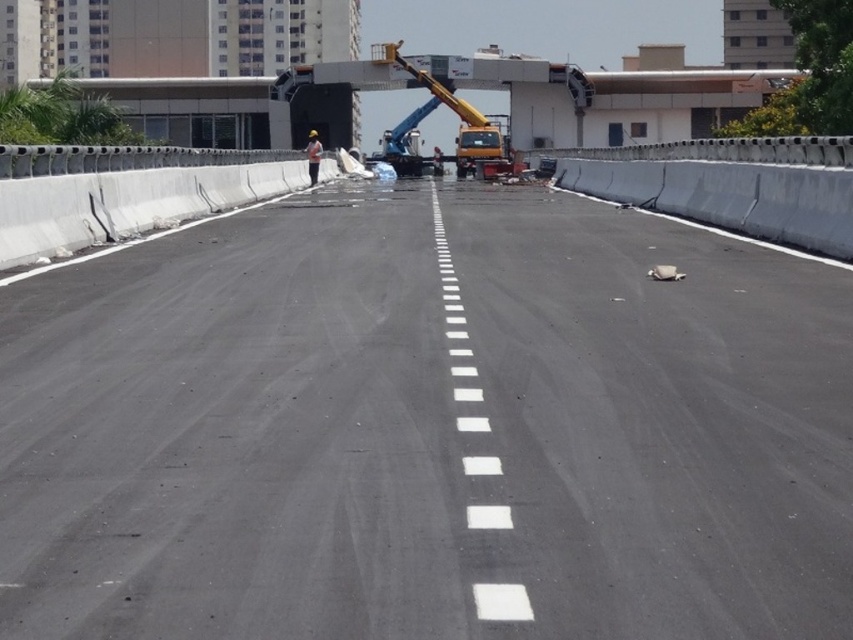
Based on the photo, who is positioned more to the left, black asphalt highway at center or white reflective vest at center?

From the viewer's perspective, white reflective vest at center appears more on the left side.

The height and width of the screenshot is (640, 853). In order to click on black asphalt highway at center in this screenshot , I will do `click(428, 429)`.

At what (x,y) coordinates should I click in order to perform the action: click on black asphalt highway at center. Please return your answer as a coordinate pair (x, y). The height and width of the screenshot is (640, 853). Looking at the image, I should click on tap(428, 429).

Is black asphalt highway at center bigger than yellow metallic crane at center?

Incorrect, black asphalt highway at center is not larger than yellow metallic crane at center.

Is black asphalt highway at center shorter than yellow metallic crane at center?

Yes.

The width and height of the screenshot is (853, 640). In order to click on black asphalt highway at center in this screenshot , I will do `click(428, 429)`.

Locate an element on the screen. The image size is (853, 640). black asphalt highway at center is located at coordinates (428, 429).

Does yellow metallic crane at center appear on the right side of white reflective vest at center?

Indeed, yellow metallic crane at center is positioned on the right side of white reflective vest at center.

Is yellow metallic crane at center wider than white reflective vest at center?

Indeed, yellow metallic crane at center has a greater width compared to white reflective vest at center.

What are the coordinates of `yellow metallic crane at center` in the screenshot? It's located at (451, 109).

You are a GUI agent. You are given a task and a screenshot of the screen. Output one action in this format:
    pyautogui.click(x=<x>, y=<y>)
    Task: Click on the yellow metallic crane at center
    
    Given the screenshot: What is the action you would take?
    pyautogui.click(x=451, y=109)